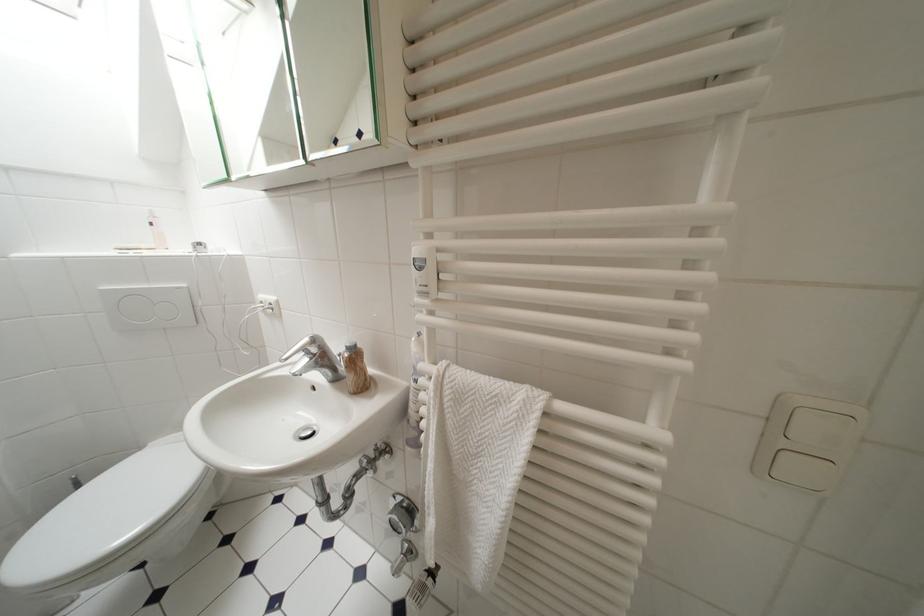
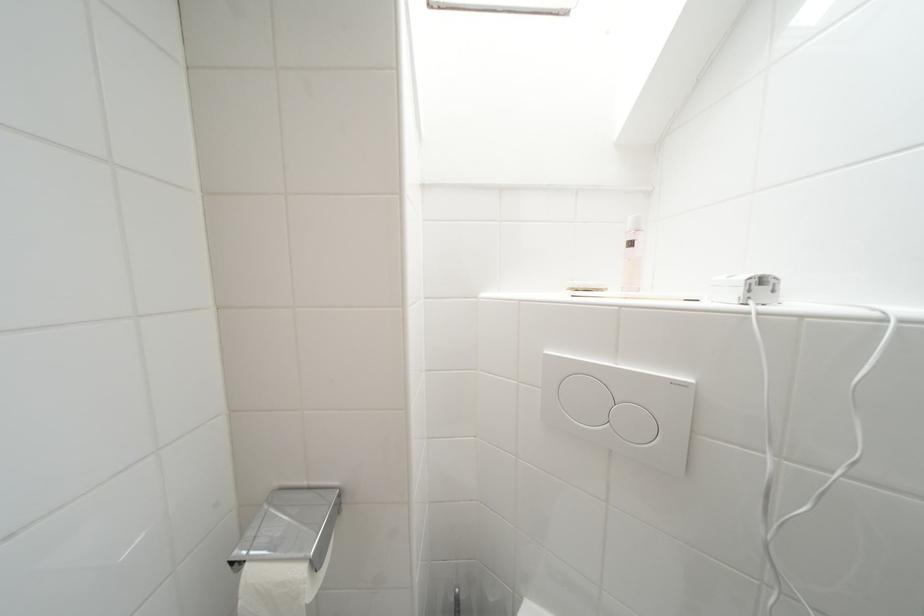
Locate, in the second image, the point that corresponds to (x=159, y=227) in the first image.

(638, 246)